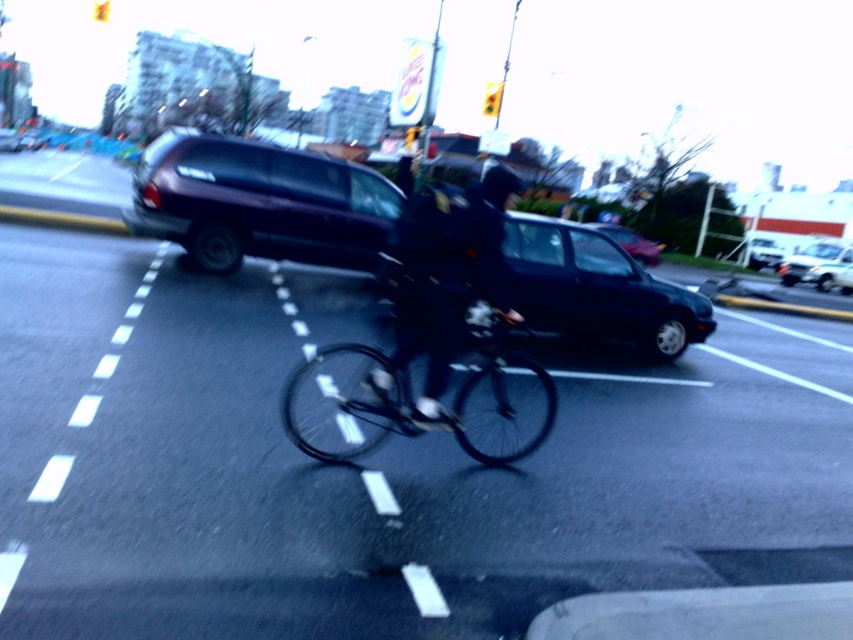
Question: Can you confirm if metallic purple suv at center is positioned below white glossy suv at center?

Choices:
 (A) no
 (B) yes

Answer: (B)

Question: Considering the real-world distances, which object is closest to the shiny black sedan at center?

Choices:
 (A) white glossy suv at center
 (B) metallic purple suv at center

Answer: (A)

Question: Considering the real-world distances, which object is closest to the black rubber bike lane at center?

Choices:
 (A) dark blue jeans at center
 (B) dark blue matte suv at center
 (C) black matte helmet at center
 (D) shiny black sedan at center

Answer: (A)

Question: Which is farther from the metallic purple suv at center?

Choices:
 (A) dark blue matte suv at center
 (B) dark blue jeans at center
 (C) black matte bicycle at center

Answer: (B)

Question: Is black rubber bike lane at center below shiny black sedan at center?

Choices:
 (A) no
 (B) yes

Answer: (B)

Question: Is dark blue matte suv at center behind black matte helmet at center?

Choices:
 (A) no
 (B) yes

Answer: (B)